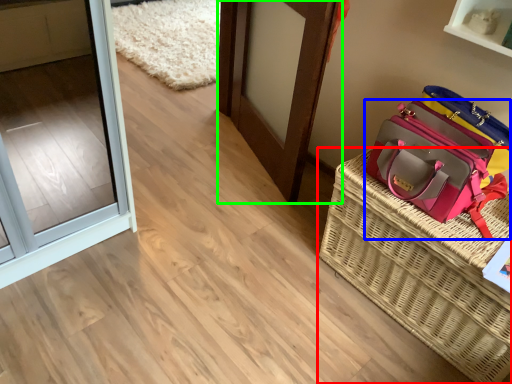
Question: Considering the real-world distances, which object is closest to picnic basket (highlighted by a red box)? handbag (highlighted by a blue box) or door (highlighted by a green box).

Choices:
 (A) handbag
 (B) door

Answer: (A)